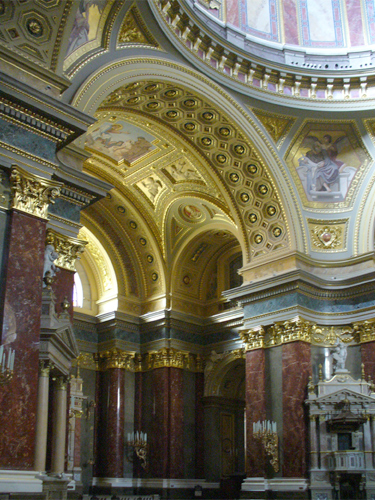
I want to click on crown molding, so click(291, 485), click(258, 480), click(185, 483), click(116, 483), click(14, 483).